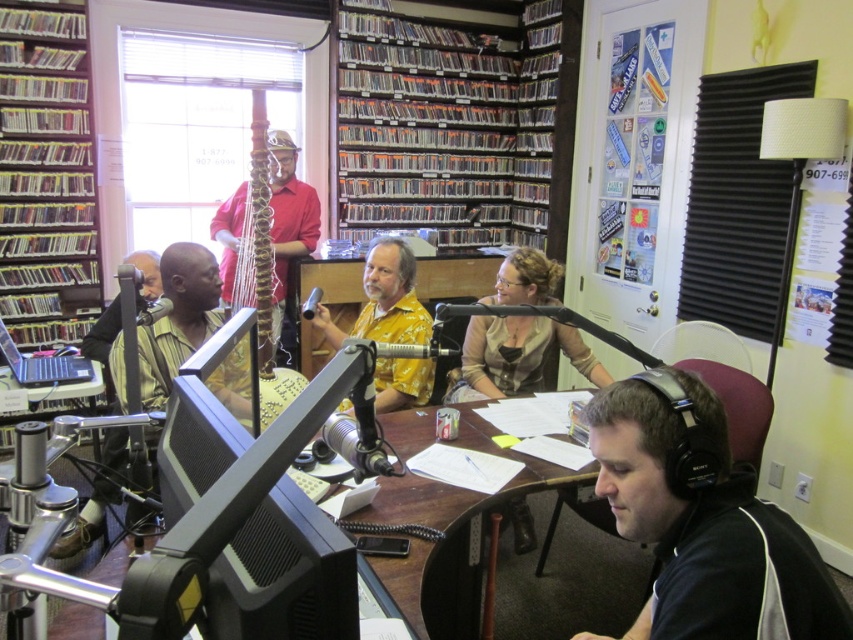
Is point (521, 109) in front of point (500, 298)?

No, (521, 109) is further to viewer.

Which is above, clear plastic cds at upper center or matte yellow shirt at center?

clear plastic cds at upper center is above.

Measure the distance between clear plastic cds at upper center and camera.

clear plastic cds at upper center and camera are 4.31 meters apart from each other.

You are a GUI agent. You are given a task and a screenshot of the screen. Output one action in this format:
    pyautogui.click(x=<x>, y=<y>)
    Task: Click on the clear plastic cds at upper center
    
    Given the screenshot: What is the action you would take?
    pyautogui.click(x=457, y=122)

Which of these two, clear plastic cds at upper center or matte black laptop at left, stands shorter?

matte black laptop at left is shorter.

Is point (535, 10) closer to viewer compared to point (68, 381)?

No, (535, 10) is further to viewer.

Between point (368, 92) and point (80, 380), which one is positioned in front?

Point (80, 380) is more forward.

This screenshot has height=640, width=853. In order to click on clear plastic cds at upper center in this screenshot , I will do `click(457, 122)`.

Looking at this image, who is more forward, (456, 211) or (280, 170)?

Point (280, 170) is in front.

Does clear plastic cds at upper center appear on the right side of wooden harp at center?

Yes, clear plastic cds at upper center is to the right of wooden harp at center.

Who is more distant from viewer, [451,168] or [286,164]?

The point [451,168] is behind.

The height and width of the screenshot is (640, 853). In order to click on clear plastic cds at upper center in this screenshot , I will do `click(457, 122)`.